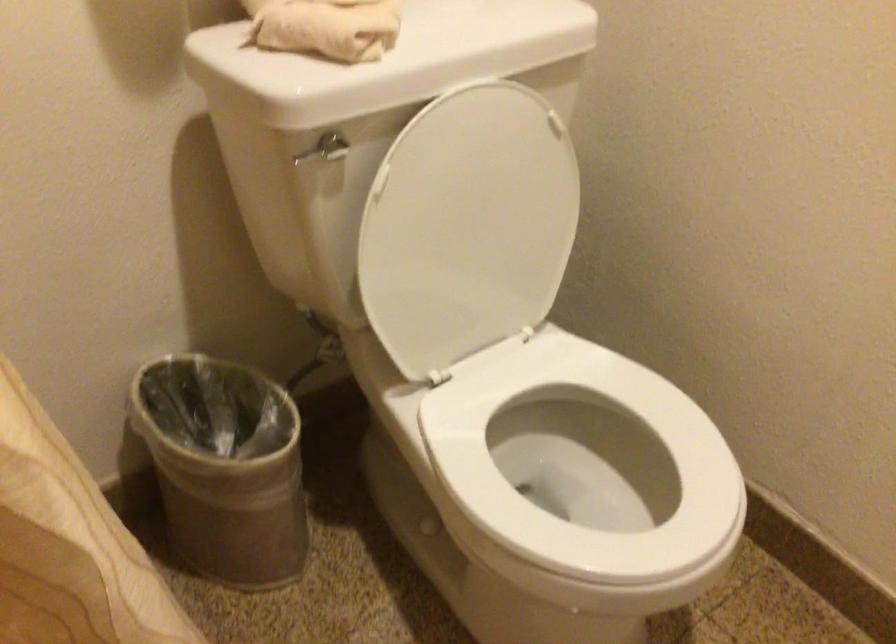
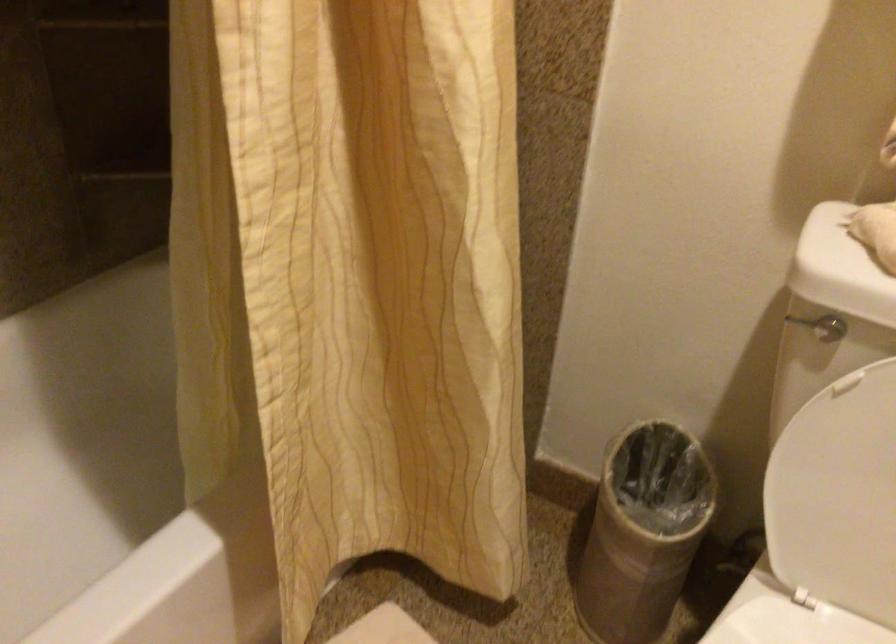
Where in the second image is the point corresponding to (x=409, y=270) from the first image?

(834, 480)